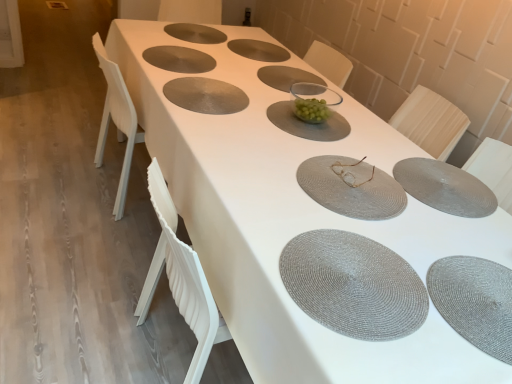
You are a GUI agent. You are given a task and a screenshot of the screen. Output one action in this format:
    pyautogui.click(x=<x>, y=<y>)
    Task: Click on the free space that is in between gray woven placemat at center and gray woven placemat at center
    
    Given the screenshot: What is the action you would take?
    pyautogui.click(x=249, y=157)